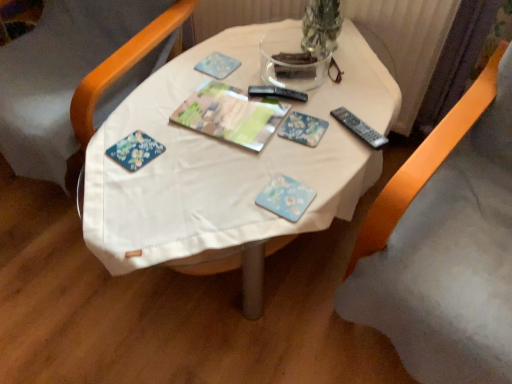
Locate an element on the screen. This screenshot has height=384, width=512. free region on the left part of black plastic remote at right is located at coordinates (287, 130).